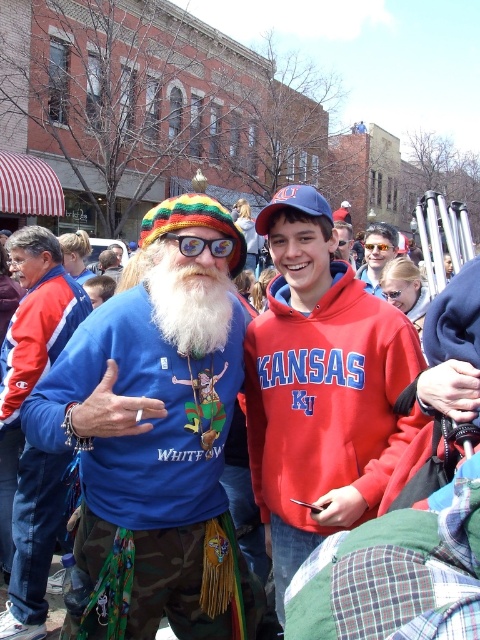
You are standing at the center of the image and want to find the whitewoolbeard at center. In which direction should you look to locate him?

The whitewoolbeard at center is located at point coordinates, so you should look directly ahead since he is at the center of the image.

Looking at this image, you are a photographer trying to capture a candid shot of the two items at the center of the image, the red fleece hoodie at center and the matte sunglasses at center. To ensure both are in frame, you need to know their arrangement. Which item is located to the left of the other?

The red fleece hoodie at center is positioned on the left side of matte sunglasses at center, so the red fleece hoodie at center is to the left of the matte sunglasses at center.